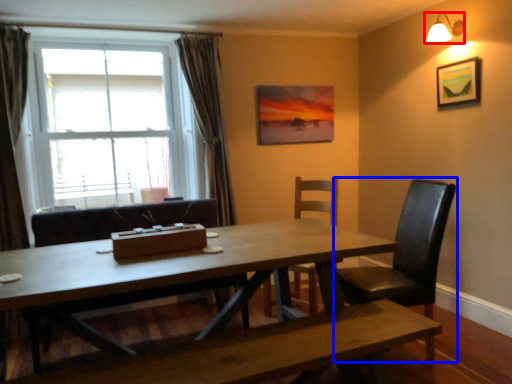
Question: Among these objects, which one is nearest to the camera, lamp (highlighted by a red box) or chair (highlighted by a blue box)?

Choices:
 (A) lamp
 (B) chair

Answer: (B)